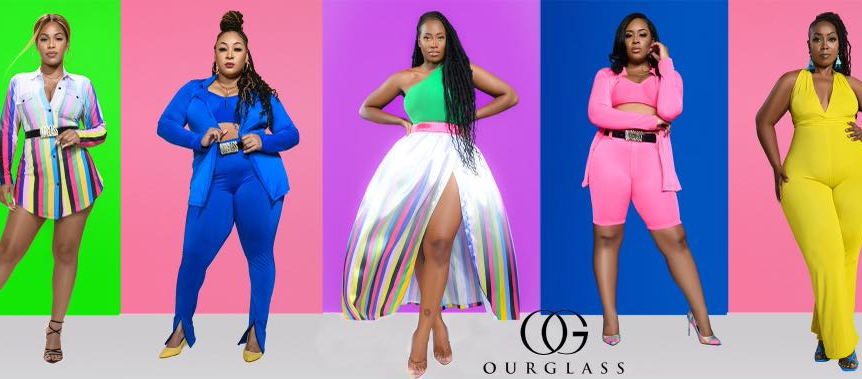
Identify the location of floor. This screenshot has height=379, width=862. (320, 352).